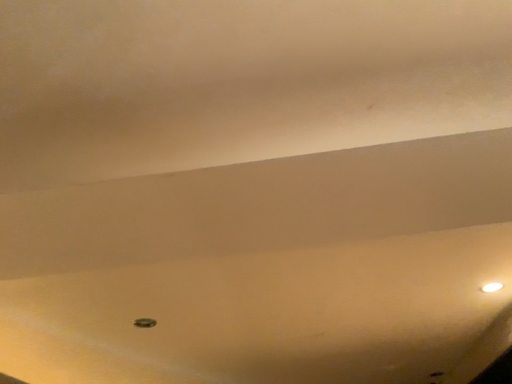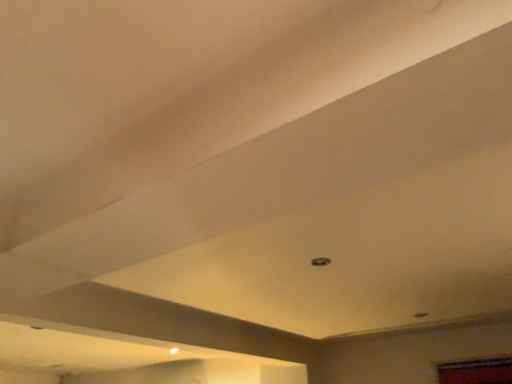
Question: Which way did the camera rotate in the video?

Choices:
 (A) rotated upward
 (B) rotated downward

Answer: (B)